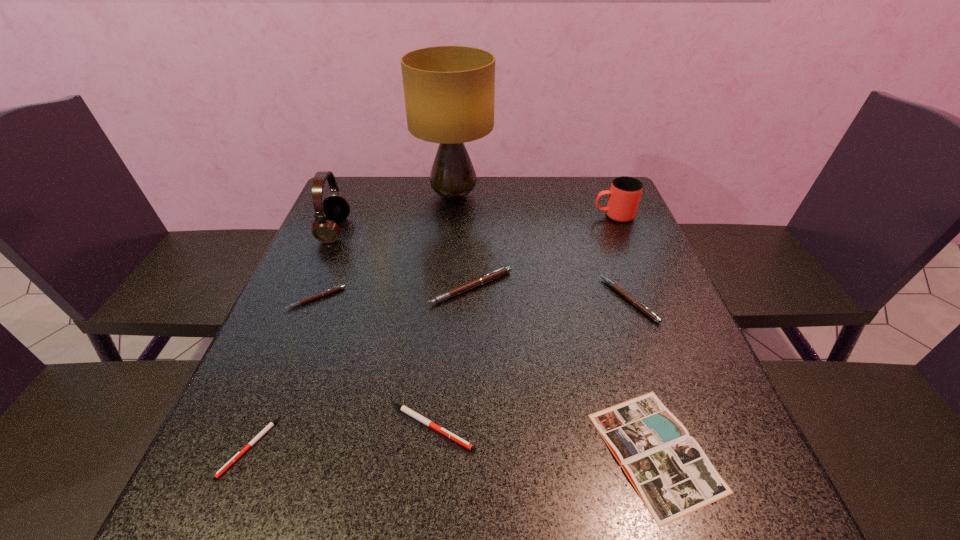
Locate an element on the screen. This screenshot has width=960, height=540. the leftmost pink pen is located at coordinates click(x=340, y=287).

Identify the location of the right white pen. The image size is (960, 540). (429, 423).

At what (x,y) coordinates should I click in order to perform the action: click on book. Please return your answer as a coordinate pair (x, y). This screenshot has width=960, height=540. Looking at the image, I should click on (671, 473).

This screenshot has width=960, height=540. In order to click on the smaller white pen in this screenshot , I will do click(271, 424).

Image resolution: width=960 pixels, height=540 pixels. I want to click on the shortest object, so 271,424.

Identify the location of free region located 0.400m on the right of the beige lampshade. (623, 197).

Identify the location of vacant space located on the ear pads of the headset. (399, 230).

You are a GUI agent. You are given a task and a screenshot of the screen. Output one action in this format:
    pyautogui.click(x=<x>, y=<y>)
    Task: Click on the vacant region located on the handle side of the cup
    
    Given the screenshot: What is the action you would take?
    pyautogui.click(x=572, y=216)

This screenshot has width=960, height=540. Identify the location of free space located 0.140m on the handle side of the cup. (544, 216).

I want to click on vacant space located 0.150m on the handle side of the cup, so click(x=541, y=216).